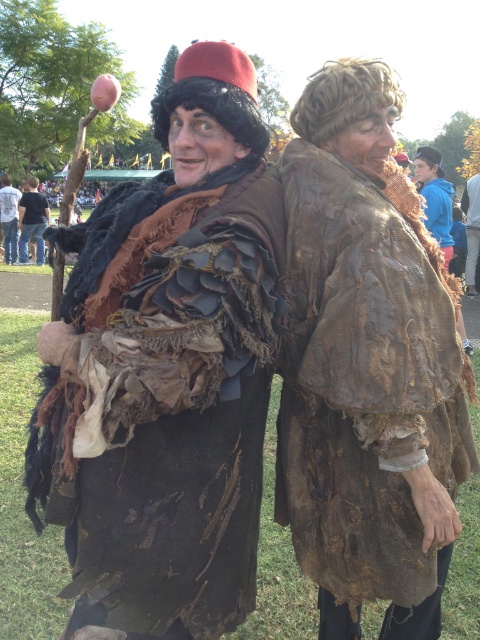
Question: From the image, what is the correct spatial relationship of blue fleece jacket at right in relation to rusty fabric coat at center?

Choices:
 (A) below
 (B) above

Answer: (A)

Question: Which of the following is the closest to the observer?

Choices:
 (A) dark brown leather jacket at center
 (B) brown textured fabric at center
 (C) rusty fabric coat at center
 (D) rusty fabric cloak at center

Answer: (D)

Question: Which point is farther to the camera?

Choices:
 (A) (17, 205)
 (B) (156, 346)
 (C) (379, 369)

Answer: (A)

Question: Which is farther from the brown textured fabric at center?

Choices:
 (A) dark brown leather jacket at center
 (B) rusty fabric coat at center
 (C) blue fleece jacket at right

Answer: (B)

Question: Where is rusty fabric cloak at center located in relation to dark brown leather jacket at center in the image?

Choices:
 (A) below
 (B) above

Answer: (A)

Question: Is rusty fabric cloak at center to the right of brown textured fabric at center from the viewer's perspective?

Choices:
 (A) yes
 (B) no

Answer: (B)